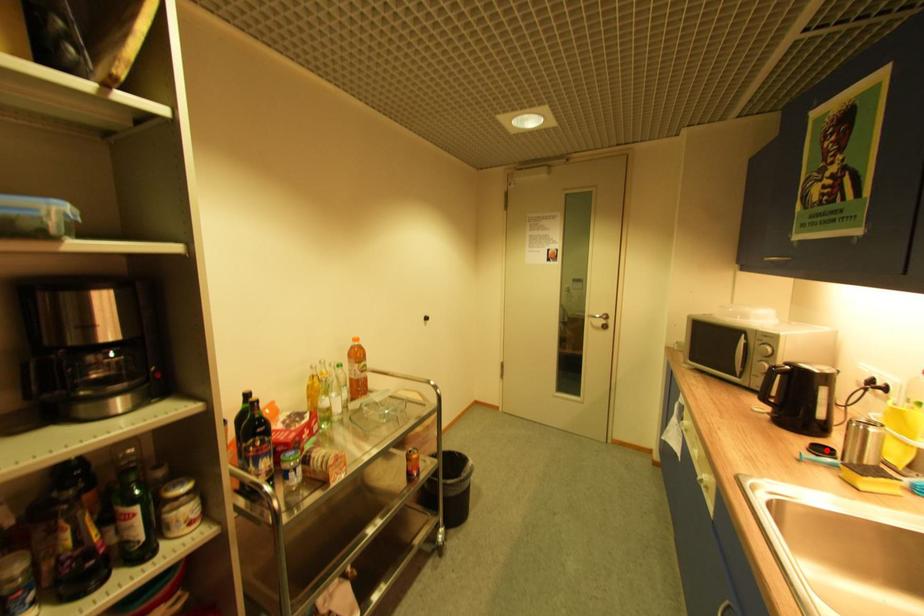
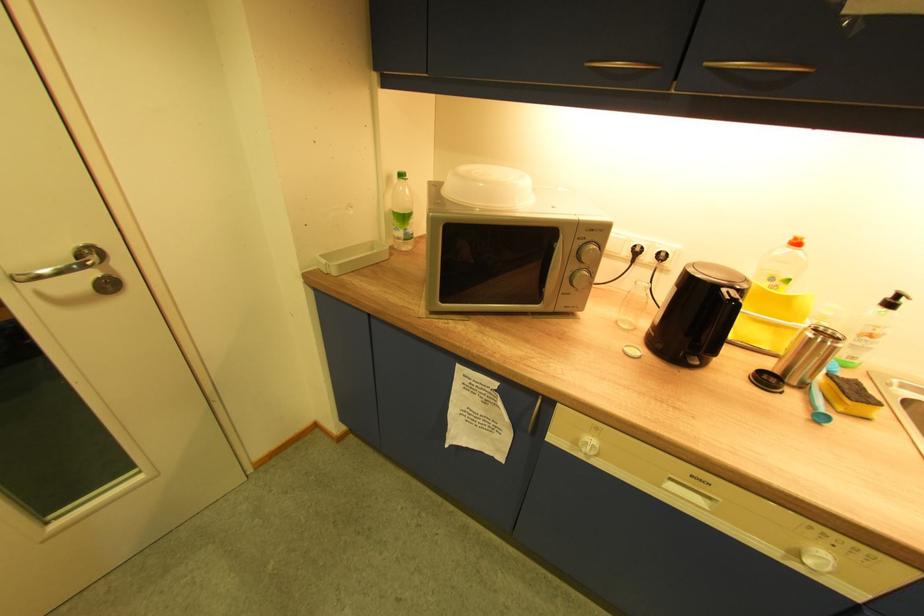
Find the pixel in the second image that matches the highlighted location in the first image.

(772, 382)